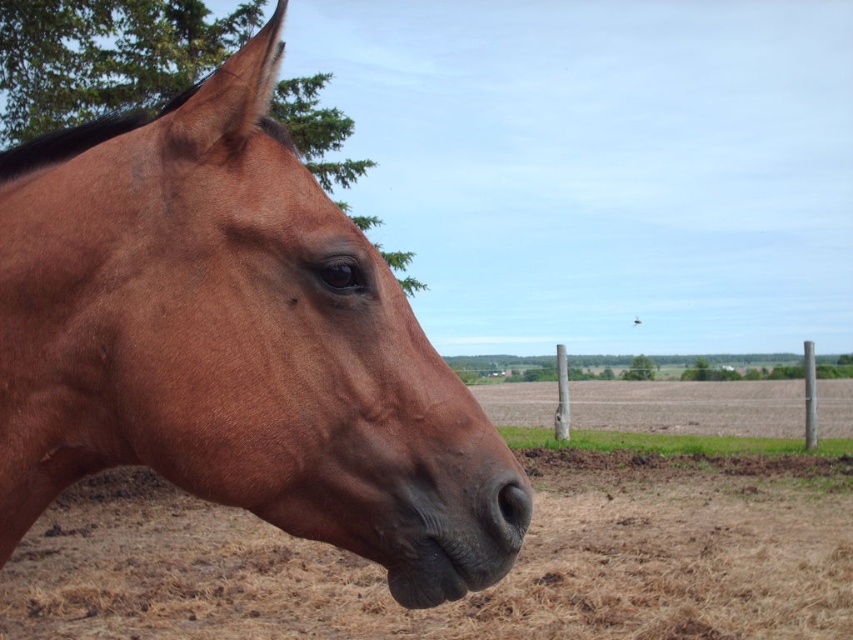
Does shiny brown horse at left come in front of wooden post at center?

Yes.

Can you confirm if shiny brown horse at left is smaller than wooden post at center?

Yes, shiny brown horse at left is smaller than wooden post at center.

Is point (244, 307) farther from camera compared to point (686, 413)?

That is False.

Locate an element on the screen. shiny brown horse at left is located at coordinates [229, 340].

Between brown dirt field at lower left and wooden post at center, which one has more height?

wooden post at center

Who is more distant from viewer, (270, 577) or (486, 412)?

The point (486, 412) is behind.

Is point (32, 538) farther from viewer compared to point (540, 385)?

That is False.

Find the location of a particular element. This screenshot has height=640, width=853. brown dirt field at lower left is located at coordinates (474, 593).

Who is more forward, [770,408] or [512,531]?

Point [512,531]

Which is behind, point (613, 388) or point (515, 515)?

The point (613, 388) is more distant.

This screenshot has width=853, height=640. Identify the location of wooden post at center. pos(689,406).